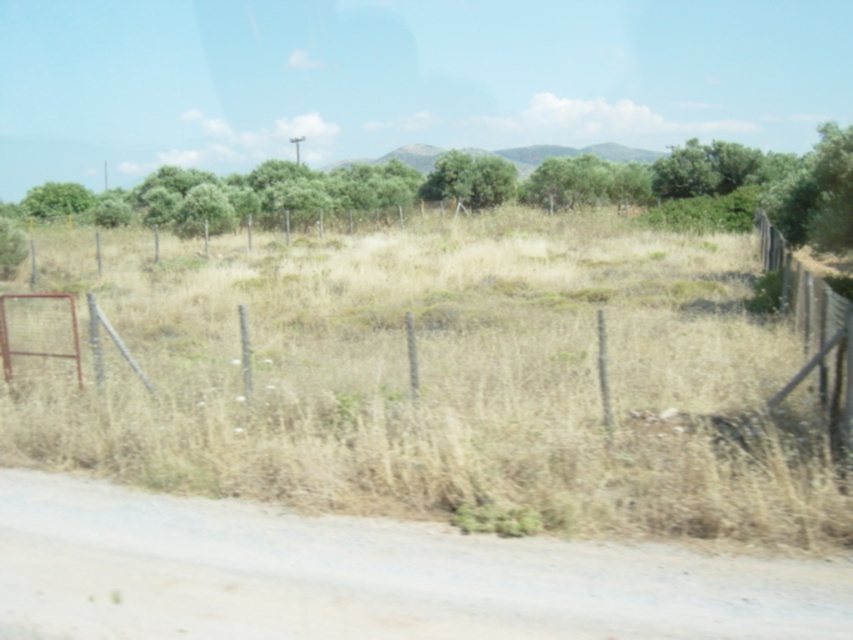
Question: Which object is positioned farthest from the brown dirt track at lower left?

Choices:
 (A) green leafy tree at center
 (B) green leafy tree at upper center

Answer: (A)

Question: Which object appears farthest from the camera in this image?

Choices:
 (A) green leafy tree at upper center
 (B) brown dirt track at lower left

Answer: (A)

Question: Does green leafy tree at upper center appear on the right side of wooden fence at right?

Choices:
 (A) no
 (B) yes

Answer: (A)

Question: Which of the following is the closest to the observer?

Choices:
 (A) (640, 625)
 (B) (428, 176)
 (C) (786, 276)
 (D) (636, 170)

Answer: (A)

Question: Does brown dirt track at lower left appear on the right side of green leafy tree at center?

Choices:
 (A) no
 (B) yes

Answer: (A)

Question: Considering the relative positions of brown dirt track at lower left and wooden fence at right in the image provided, where is brown dirt track at lower left located with respect to wooden fence at right?

Choices:
 (A) left
 (B) right

Answer: (A)